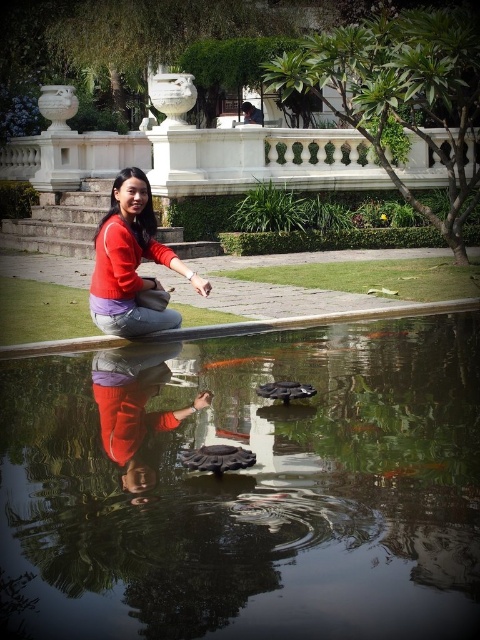
You are standing in the garden and want to take a photo of both the transparent glass fish pond at center and the matte red sweater at center. Which object should you position to your left to include both in the frame?

You should position the matte red sweater at center to your left since the transparent glass fish pond at center is to the right of it.

You are a photographer wanting to capture both the transparent glass fish pond at center and the matte red sweater at center in a single shot. Which object will appear larger in the photo?

The matte red sweater at center will appear larger in the photo because it is larger than the transparent glass fish pond at center.